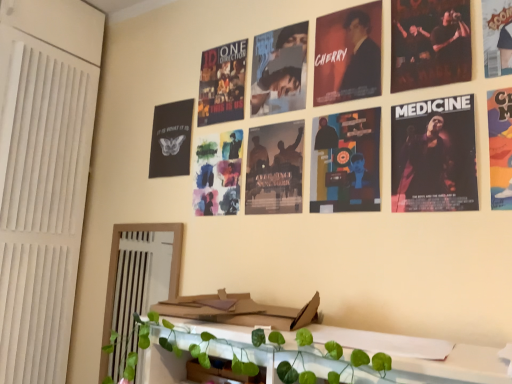
I want to click on matte black poster at center, positioned as the fifth poster in right-to-left order, so pos(346,162).

Where is `matte black poster at upper right, the fourth poster from the left`? This screenshot has height=384, width=512. matte black poster at upper right, the fourth poster from the left is located at coordinates (430, 43).

What do you see at coordinates (274, 169) in the screenshot? This screenshot has height=384, width=512. I see `matte paper poster at center, which ranks as the 6th poster in right-to-left order` at bounding box center [274, 169].

Find the location of a particular element. This screenshot has width=512, height=384. cardboard magazine at center is located at coordinates (239, 311).

Who is taller, colorful paper poster at upper right, the 2th poster positioned from the right, or cartoon character poster at upper right, positioned as the sixth poster in left-to-right order?

colorful paper poster at upper right, the 2th poster positioned from the right, is taller.

Is colorful paper poster at upper right, arranged as the fifth poster when viewed from the left, directly adjacent to cartoon character poster at upper right, which ranks as the first poster in right-to-left order?

No, colorful paper poster at upper right, arranged as the fifth poster when viewed from the left, is not beside cartoon character poster at upper right, which ranks as the first poster in right-to-left order.

Does point (498, 174) lie in front of point (503, 69)?

Yes, it is.

Is colorful paper poster at upper right, arranged as the fifth poster when viewed from the left, spatially inside cartoon character poster at upper right, positioned as the sixth poster in left-to-right order, or outside of it?

colorful paper poster at upper right, arranged as the fifth poster when viewed from the left, is outside cartoon character poster at upper right, positioned as the sixth poster in left-to-right order.

Looking at this image, is matte paper poster at center, acting as the first poster starting from the left, shorter than matte black poster at upper right, the fourth poster from the left?

Correct, matte paper poster at center, acting as the first poster starting from the left, is not as tall as matte black poster at upper right, the fourth poster from the left.

This screenshot has width=512, height=384. What are the coordinates of `poster that is the 3rd object located behind the matte black poster at upper right, arranged as the 3th poster when viewed from the right` in the screenshot? It's located at (274, 169).

Is point (292, 200) positioned before point (461, 59)?

No.

Is matte paper poster at center, which ranks as the 6th poster in right-to-left order, placed right next to matte black poster at upper right, arranged as the 3th poster when viewed from the right?

matte paper poster at center, which ranks as the 6th poster in right-to-left order, is not next to matte black poster at upper right, arranged as the 3th poster when viewed from the right, and they're not touching.

Does cartoon character poster at upper right, which ranks as the first poster in right-to-left order, turn towards dark matte poster at upper center, the 3th poster in the left-to-right sequence?

No, cartoon character poster at upper right, which ranks as the first poster in right-to-left order, is not turned towards dark matte poster at upper center, the 3th poster in the left-to-right sequence.

Considering the relative sizes of cartoon character poster at upper right, positioned as the sixth poster in left-to-right order, and dark matte poster at upper center, the 3th poster in the left-to-right sequence, in the image provided, is cartoon character poster at upper right, positioned as the sixth poster in left-to-right order, taller than dark matte poster at upper center, the 3th poster in the left-to-right sequence,?

No.

Between cartoon character poster at upper right, positioned as the sixth poster in left-to-right order, and dark matte poster at upper center, the 3th poster in the left-to-right sequence, which one is positioned behind?

dark matte poster at upper center, the 3th poster in the left-to-right sequence, is further away from the camera.

Is matte black poster at center, positioned as the fifth poster in right-to-left order, taller than colorful paper poster at upper right, the 2th poster positioned from the right?

Yes.

From the image's perspective, is matte black poster at center, positioned as the second poster in left-to-right order, above or below colorful paper poster at upper right, the 2th poster positioned from the right?

From the image's perspective, matte black poster at center, positioned as the second poster in left-to-right order, appears below colorful paper poster at upper right, the 2th poster positioned from the right.

There is a colorful paper poster at upper right, the 2th poster positioned from the right. Identify the location of the 1st poster below it (from the image's perspective). click(x=346, y=162).

Is matte black poster at center, positioned as the second poster in left-to-right order, spatially inside colorful paper poster at upper right, arranged as the fifth poster when viewed from the left, or outside of it?

matte black poster at center, positioned as the second poster in left-to-right order, is spatially situated outside colorful paper poster at upper right, arranged as the fifth poster when viewed from the left.

Considering the sizes of objects colorful paper poster at upper right, arranged as the fifth poster when viewed from the left, and dark matte poster at upper center, the 3th poster in the left-to-right sequence, in the image provided, who is taller, colorful paper poster at upper right, arranged as the fifth poster when viewed from the left, or dark matte poster at upper center, the 3th poster in the left-to-right sequence,?

colorful paper poster at upper right, arranged as the fifth poster when viewed from the left, is taller.

Between colorful paper poster at upper right, arranged as the fifth poster when viewed from the left, and dark matte poster at upper center, the fourth poster from the right, which one appears on the right side from the viewer's perspective?

Positioned to the right is colorful paper poster at upper right, arranged as the fifth poster when viewed from the left.

From a real-world perspective, is colorful paper poster at upper right, arranged as the fifth poster when viewed from the left, physically located above or below dark matte poster at upper center, the 3th poster in the left-to-right sequence?

colorful paper poster at upper right, arranged as the fifth poster when viewed from the left, is situated lower than dark matte poster at upper center, the 3th poster in the left-to-right sequence, in the real world.

What's the angular difference between colorful paper poster at upper right, the 2th poster positioned from the right, and dark matte poster at upper center, the 3th poster in the left-to-right sequence,'s facing directions?

The angle between the facing direction of colorful paper poster at upper right, the 2th poster positioned from the right, and the facing direction of dark matte poster at upper center, the 3th poster in the left-to-right sequence, is 1.49 degrees.

From a real-world perspective, is matte paper poster at center, acting as the first poster starting from the left, on top of colorful paper poster at upper right, arranged as the fifth poster when viewed from the left?

A: No, from a real-world perspective, matte paper poster at center, acting as the first poster starting from the left, is not on top of colorful paper poster at upper right, arranged as the fifth poster when viewed from the left.

Who is taller, matte paper poster at center, acting as the first poster starting from the left, or colorful paper poster at upper right, the 2th poster positioned from the right?

With more height is colorful paper poster at upper right, the 2th poster positioned from the right.

Could colorful paper poster at upper right, the 2th poster positioned from the right, be considered to be inside matte paper poster at center, acting as the first poster starting from the left?

No, colorful paper poster at upper right, the 2th poster positioned from the right, is not inside matte paper poster at center, acting as the first poster starting from the left.

Based on the photo, which is more to the left, matte paper poster at center, acting as the first poster starting from the left, or colorful paper poster at upper right, the 2th poster positioned from the right?

matte paper poster at center, acting as the first poster starting from the left.

Between cardboard magazine at center and colorful paper poster at upper right, the 2th poster positioned from the right, which one has smaller width?

colorful paper poster at upper right, the 2th poster positioned from the right, is thinner.

Are cardboard magazine at center and colorful paper poster at upper right, the 2th poster positioned from the right, far apart?

No, cardboard magazine at center is not far from colorful paper poster at upper right, the 2th poster positioned from the right.

From a real-world perspective, which is physically above, cardboard magazine at center or colorful paper poster at upper right, arranged as the fifth poster when viewed from the left?

From a 3D spatial view, colorful paper poster at upper right, arranged as the fifth poster when viewed from the left, is above.

In the scene shown: How distant is cardboard magazine at center from colorful paper poster at upper right, the 2th poster positioned from the right?

cardboard magazine at center is 25.93 inches from colorful paper poster at upper right, the 2th poster positioned from the right.

This screenshot has height=384, width=512. I want to click on poster that is the 2nd object directly below the cartoon character poster at upper right, which ranks as the first poster in right-to-left order (from a real-world perspective), so click(500, 147).

Identify the location of poster that is the 4th one when counting upward from the matte paper poster at center, which ranks as the 6th poster in right-to-left order (from the image's perspective). The image size is (512, 384). (430, 43).

When comparing their distances from matte black poster at center, positioned as the fifth poster in right-to-left order, does cardboard magazine at center or matte black poster at upper right, the fourth poster from the left, seem further?

Among the two, cardboard magazine at center is located further to matte black poster at center, positioned as the fifth poster in right-to-left order.

When comparing their distances from cartoon character poster at upper right, which ranks as the first poster in right-to-left order, does colorful paper poster at upper right, the 2th poster positioned from the right, or matte black poster at upper right, arranged as the 3th poster when viewed from the right, seem closer?

matte black poster at upper right, arranged as the 3th poster when viewed from the right, is positioned closer to the anchor cartoon character poster at upper right, which ranks as the first poster in right-to-left order.

Considering their positions, is matte black poster at upper right, arranged as the 3th poster when viewed from the right, positioned further to dark matte poster at upper center, the fourth poster from the right, than matte paper poster at center, acting as the first poster starting from the left?

matte paper poster at center, acting as the first poster starting from the left.

Looking at the image, which one is located further to matte paper poster at center, which ranks as the 6th poster in right-to-left order, cartoon character poster at upper right, which ranks as the first poster in right-to-left order, or cardboard magazine at center?

cartoon character poster at upper right, which ranks as the first poster in right-to-left order.

Looking at the image, which one is located further to matte paper poster at center, which ranks as the 6th poster in right-to-left order, matte black poster at upper right, the fourth poster from the left, or cardboard magazine at center?

matte black poster at upper right, the fourth poster from the left, is positioned further to the anchor matte paper poster at center, which ranks as the 6th poster in right-to-left order.

Estimate the real-world distances between objects in this image. Which object is closer to dark matte poster at upper center, the fourth poster from the right, cardboard magazine at center or colorful paper poster at upper right, arranged as the fifth poster when viewed from the left?

colorful paper poster at upper right, arranged as the fifth poster when viewed from the left, is closer to dark matte poster at upper center, the fourth poster from the right.

In the scene shown: Which object lies further to the anchor point dark matte poster at upper center, the 3th poster in the left-to-right sequence, matte paper poster at center, acting as the first poster starting from the left, or matte black poster at upper right, the fourth poster from the left?

matte paper poster at center, acting as the first poster starting from the left.

When comparing their distances from matte paper poster at center, acting as the first poster starting from the left, does matte black poster at upper right, arranged as the 3th poster when viewed from the right, or cartoon character poster at upper right, positioned as the sixth poster in left-to-right order, seem further?

cartoon character poster at upper right, positioned as the sixth poster in left-to-right order, is positioned further to the anchor matte paper poster at center, acting as the first poster starting from the left.

Image resolution: width=512 pixels, height=384 pixels. Find the location of `poster between dark matte poster at upper center, the fourth poster from the right, and colorful paper poster at upper right, arranged as the fifth poster when viewed from the left, in the horizontal direction`. poster between dark matte poster at upper center, the fourth poster from the right, and colorful paper poster at upper right, arranged as the fifth poster when viewed from the left, in the horizontal direction is located at coordinates (430, 43).

The height and width of the screenshot is (384, 512). I want to click on poster between matte black poster at center, positioned as the second poster in left-to-right order, and cardboard magazine at center from top to bottom, so click(x=274, y=169).